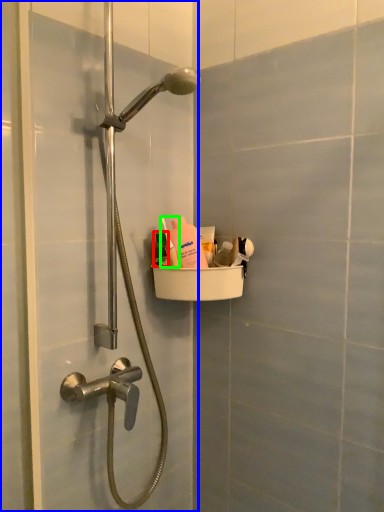
Question: Which is farther away from mouthwash (highlighted by a red box)? screen door (highlighted by a blue box) or toiletry (highlighted by a green box)?

Choices:
 (A) screen door
 (B) toiletry

Answer: (A)